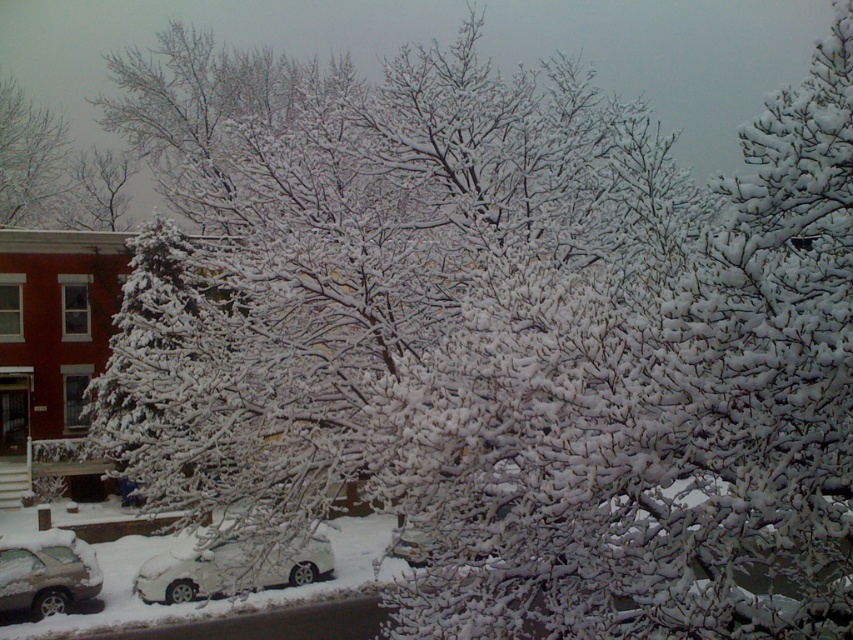
Is white matte car at lower left further to the viewer compared to white snow-covered tree at upper left?

No, white matte car at lower left is closer to the viewer.

Which is behind, point (316, 554) or point (51, 179)?

Point (51, 179)

Where is `white matte car at lower left`? This screenshot has width=853, height=640. white matte car at lower left is located at coordinates (227, 570).

Does white snow-covered tree at upper left lie behind silver metallic car at lower left?

Yes, it is.

Is white snow-covered tree at upper left smaller than silver metallic car at lower left?

Actually, white snow-covered tree at upper left might be larger than silver metallic car at lower left.

Where is `white snow-covered tree at upper left`? white snow-covered tree at upper left is located at coordinates (28, 157).

In the scene shown: Does white matte car at lower left have a larger size compared to silver metallic car at lower left?

No, white matte car at lower left is not bigger than silver metallic car at lower left.

Between white matte car at lower left and silver metallic car at lower left, which one is positioned higher?

Positioned higher is silver metallic car at lower left.

Where is `white matte car at lower left`? The width and height of the screenshot is (853, 640). white matte car at lower left is located at coordinates (227, 570).